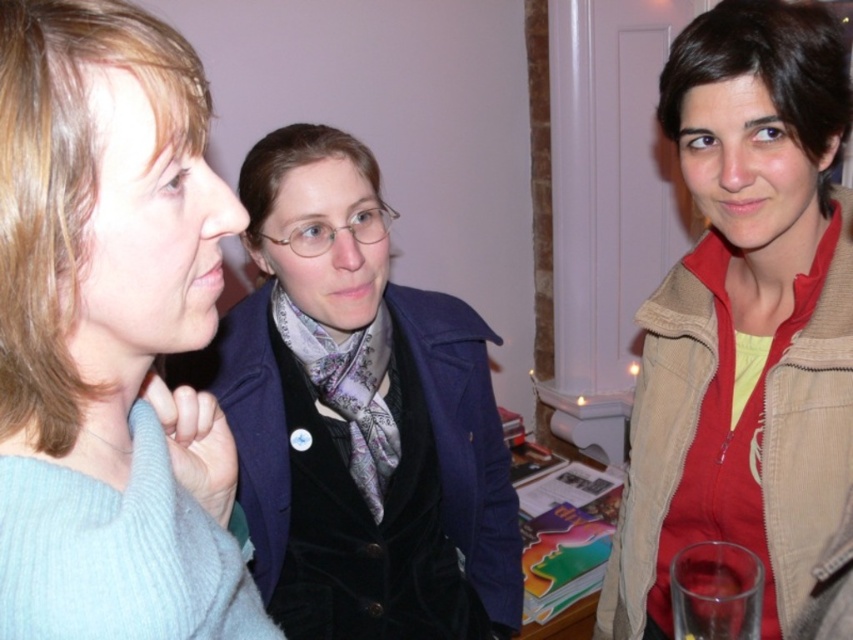
Is point (10, 211) positioned before point (674, 593)?

Yes, it is in front of point (674, 593).

Is the position of light blue sweater at left more distant than that of clear glass at lower right?

No, it is in front of clear glass at lower right.

At what (x,y) coordinates should I click in order to perform the action: click on light blue sweater at left. Please return your answer as a coordinate pair (x, y). Looking at the image, I should click on (105, 328).

The image size is (853, 640). In order to click on light blue sweater at left in this screenshot , I will do `click(105, 328)`.

How distant is tan corduroy jacket at right from clear glass at lower right?

11.90 inches

Does tan corduroy jacket at right appear over clear glass at lower right?

Indeed, tan corduroy jacket at right is positioned over clear glass at lower right.

Is point (827, 129) farther from viewer compared to point (693, 604)?

Yes, it is behind point (693, 604).

This screenshot has height=640, width=853. In order to click on tan corduroy jacket at right in this screenshot , I will do `click(744, 317)`.

Who is positioned more to the left, tan corduroy jacket at right or velvet blue coat at center?

velvet blue coat at center is more to the left.

Where is `tan corduroy jacket at right`? This screenshot has height=640, width=853. tan corduroy jacket at right is located at coordinates (744, 317).

Image resolution: width=853 pixels, height=640 pixels. Identify the location of tan corduroy jacket at right. (744, 317).